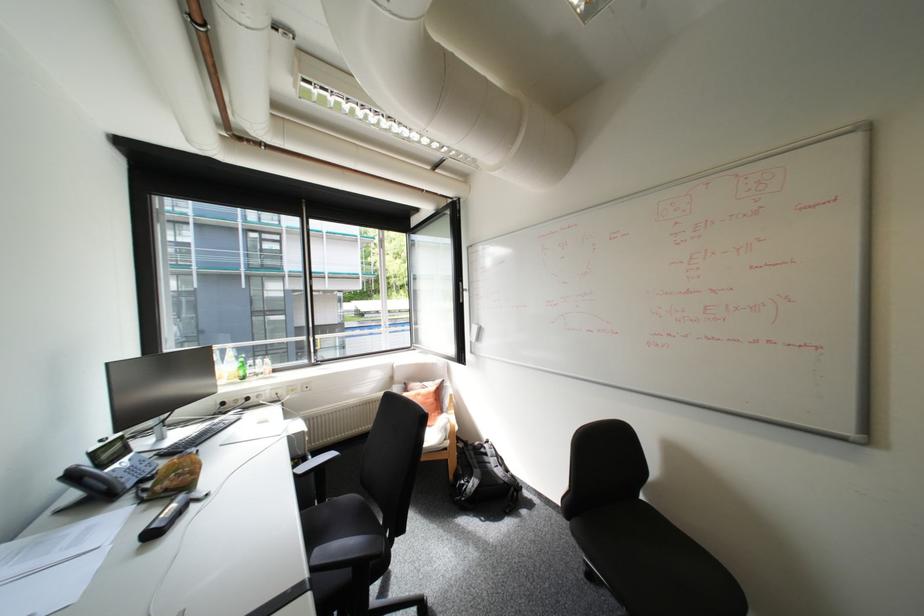
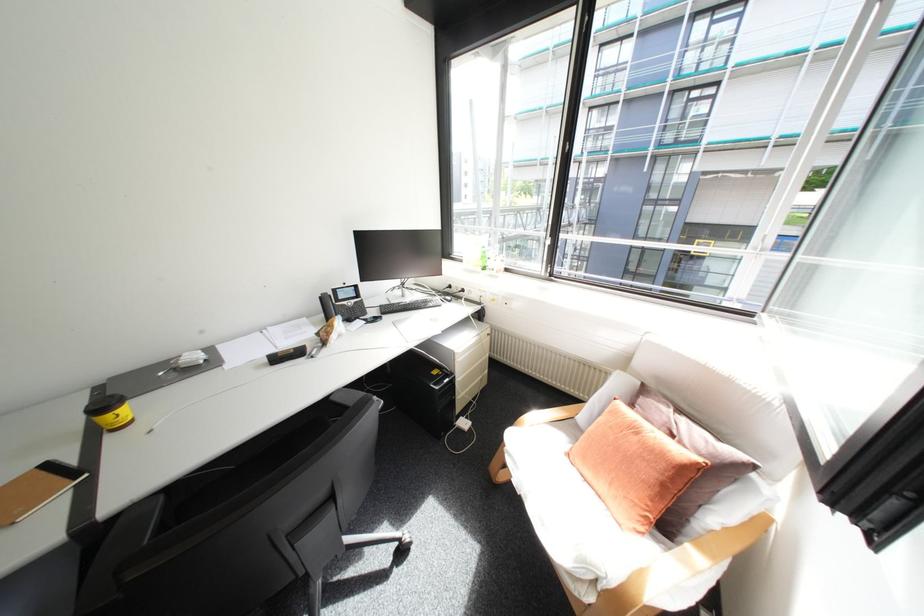
The point at (71, 475) is marked in the first image. Where is the corresponding point in the second image?

(330, 296)